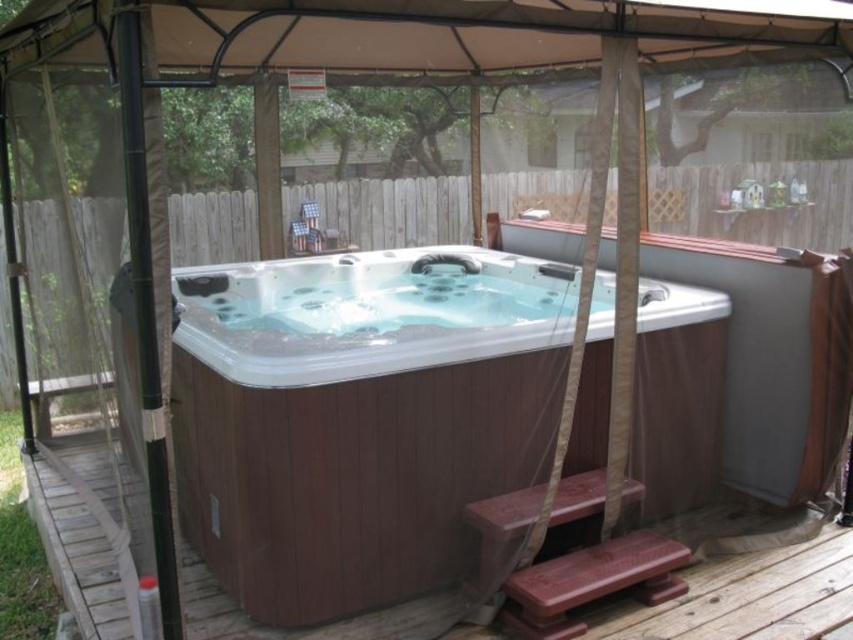
You are standing in the backyard and want to walk from the gazebo to the hot tub. You see two points marked as point 1 at coordinate (309,620) and point 2 at coordinate (83,582). Which point should you walk towards first to reach the hot tub?

Point 1 at coordinate (309,620) is in front of point 2 at coordinate (83,582), so you should walk towards point 1 first to reach the hot tub.

You are standing in the backyard and see the hot tub at center. There is a point marked at coordinates [358,417]. Where is this point located?

The point at [358,417] is on the brown wood paneling of the hot tub at center.